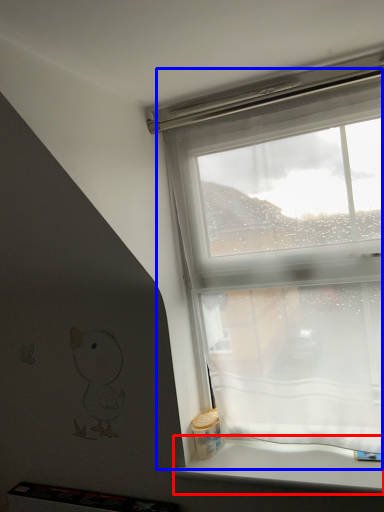
Question: Which of the following is the farthest to the observer, window sill (highlighted by a red box) or window (highlighted by a blue box)?

Choices:
 (A) window sill
 (B) window

Answer: (B)